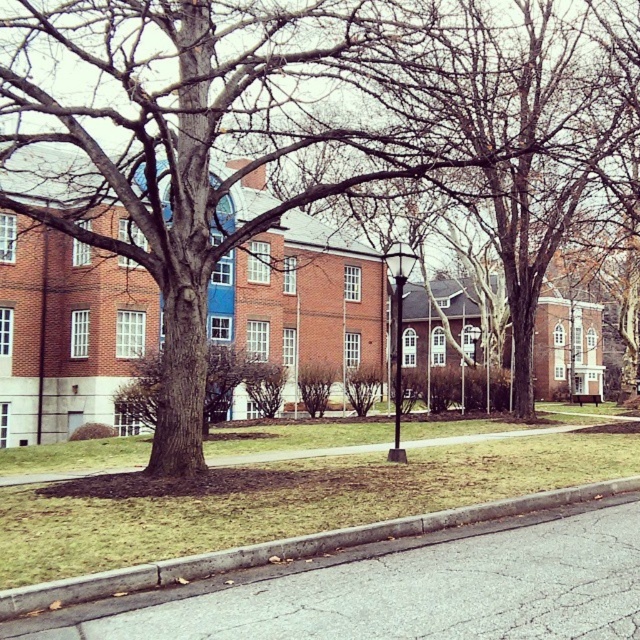
Question: Can you confirm if brown rough bark tree at center is positioned to the right of metallic pole at center?

Choices:
 (A) no
 (B) yes

Answer: (A)

Question: Can you confirm if brown rough bark tree at center is positioned above metallic pole at center?

Choices:
 (A) no
 (B) yes

Answer: (B)

Question: Which point is closer to the camera?

Choices:
 (A) (216, 109)
 (B) (65, 593)
 (C) (394, 429)

Answer: (B)

Question: Can you confirm if brown rough bark tree at center is positioned to the right of metallic pole at center?

Choices:
 (A) yes
 (B) no

Answer: (B)

Question: Among these points, which one is farthest from the camera?

Choices:
 (A) (88, 220)
 (B) (396, 337)
 (C) (282, 540)

Answer: (B)

Question: Based on their relative distances, which object is farther from the gray concrete curb at lower center?

Choices:
 (A) metallic pole at center
 (B) brown rough bark tree at center

Answer: (B)